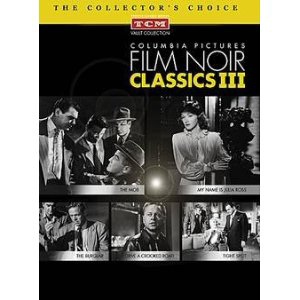
You are a GUI agent. You are given a task and a screenshot of the screen. Output one action in this format:
    pyautogui.click(x=<x>, y=<y>)
    Task: Click on the glaring light
    This screenshot has height=300, width=300.
    Given the screenshot: What is the action you would take?
    pyautogui.click(x=156, y=181)